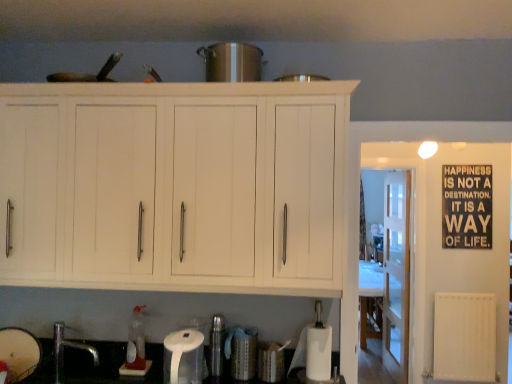
What do you see at coordinates (465, 337) in the screenshot?
I see `white plastic radiator at right` at bounding box center [465, 337].

What is the approximate width of silver metallic faucet at lower left?

silver metallic faucet at lower left is 5.24 inches wide.

The width and height of the screenshot is (512, 384). What do you see at coordinates (217, 346) in the screenshot?
I see `metallic silver canister at lower center, which is the third appliance from bottom to top` at bounding box center [217, 346].

Consider the image. What is the approximate height of metallic silver canister at lower center, which is the 1th appliance in right-to-left order?

metallic silver canister at lower center, which is the 1th appliance in right-to-left order, is 7.24 inches tall.

Image resolution: width=512 pixels, height=384 pixels. In order to click on black matte signboard at upper right in this screenshot , I will do `click(467, 206)`.

Locate an element on the screen. white plastic radiator at right is located at coordinates (465, 337).

Is shiny metallic pot at center, marked as the 3th appliance in a left-to-right arrangement, looking in the opposite direction of white plastic radiator at right?

No, shiny metallic pot at center, marked as the 3th appliance in a left-to-right arrangement, is not facing the opposite direction of white plastic radiator at right.

What's the angular difference between shiny metallic pot at center, which ranks as the 1th appliance in top-to-bottom order, and white plastic radiator at right's facing directions?

There is a 0.937-degree angle between the facing directions of shiny metallic pot at center, which ranks as the 1th appliance in top-to-bottom order, and white plastic radiator at right.

From a real-world perspective, which is physically below, shiny metallic pot at center, positioned as the fourth appliance in bottom-to-top order, or white plastic radiator at right?

white plastic radiator at right is physically lower.

Locate an element on the screen. This screenshot has height=384, width=512. radiator below the shiny metallic pot at center, positioned as the fourth appliance in bottom-to-top order (from the image's perspective) is located at coordinates (465, 337).

Can you confirm if clear glass door at center is positioned to the left of metallic silver canister at lower center, which is counted as the 2th appliance, starting from the left?

In fact, clear glass door at center is to the right of metallic silver canister at lower center, which is counted as the 2th appliance, starting from the left.

What's the angular difference between clear glass door at center and metallic silver canister at lower center, which is counted as the 2th appliance, starting from the left,'s facing directions?

The facing directions of clear glass door at center and metallic silver canister at lower center, which is counted as the 2th appliance, starting from the left, are 90.3 degrees apart.

Can you confirm if clear glass door at center is thinner than metallic silver canister at lower center, which is the third appliance from bottom to top?

Incorrect, the width of clear glass door at center is not less than that of metallic silver canister at lower center, which is the third appliance from bottom to top.

From the image's perspective, which is above, clear glass door at center or metallic silver canister at lower center, which appears as the third appliance when viewed from the right?

metallic silver canister at lower center, which appears as the third appliance when viewed from the right, from the image's perspective.

Between white matte paper towel at lower center and matte white bowl at lower left, the third appliance in the top-to-bottom sequence, which one has smaller width?

matte white bowl at lower left, the third appliance in the top-to-bottom sequence.

Could you tell me if white matte paper towel at lower center is facing matte white bowl at lower left, which is the 1th appliance from left to right?

No, white matte paper towel at lower center is not facing towards matte white bowl at lower left, which is the 1th appliance from left to right.

Find the location of a particular element. The image size is (512, 384). paper towel that appears above the matte white bowl at lower left, the second appliance from the bottom (from the image's perspective) is located at coordinates 183,357.

Is white matte paper towel at lower center completely or partially outside of matte white bowl at lower left, which is the 1th appliance from left to right?

Yes, white matte paper towel at lower center is not within matte white bowl at lower left, which is the 1th appliance from left to right.

Is matte white bowl at lower left, the fourth appliance from the right, taller than silver metallic faucet at lower left?

No, matte white bowl at lower left, the fourth appliance from the right, is not taller than silver metallic faucet at lower left.

Which of these two, matte white bowl at lower left, the fourth appliance from the right, or silver metallic faucet at lower left, is smaller?

matte white bowl at lower left, the fourth appliance from the right, is smaller.

From the image's perspective, relative to silver metallic faucet at lower left, is matte white bowl at lower left, the second appliance from the bottom, above or below?

From the image's perspective, matte white bowl at lower left, the second appliance from the bottom, appears below silver metallic faucet at lower left.

Image resolution: width=512 pixels, height=384 pixels. I want to click on appliance located on the left of silver metallic faucet at lower left, so click(x=19, y=353).

Is white plastic radiator at right to the left or to the right of metallic silver canister at lower center, which appears as the third appliance when viewed from the right, in the image?

white plastic radiator at right is positioned on metallic silver canister at lower center, which appears as the third appliance when viewed from the right,'s right side.

From a real-world perspective, who is located lower, white plastic radiator at right or metallic silver canister at lower center, positioned as the 2th appliance in top-to-bottom order?

white plastic radiator at right is physically lower.

Looking at the image, does white plastic radiator at right seem bigger or smaller compared to metallic silver canister at lower center, which is the third appliance from bottom to top?

white plastic radiator at right is bigger than metallic silver canister at lower center, which is the third appliance from bottom to top.

Based on the photo, can you confirm if translucent plastic bottle at lower left is positioned to the right of matte white bowl at lower left, the third appliance in the top-to-bottom sequence?

Yes.

Considering the relative sizes of translucent plastic bottle at lower left and matte white bowl at lower left, the third appliance in the top-to-bottom sequence, in the image provided, is translucent plastic bottle at lower left taller than matte white bowl at lower left, the third appliance in the top-to-bottom sequence,?

Yes, translucent plastic bottle at lower left is taller than matte white bowl at lower left, the third appliance in the top-to-bottom sequence.

Who is bigger, translucent plastic bottle at lower left or matte white bowl at lower left, which is the 1th appliance from left to right?

Bigger between the two is matte white bowl at lower left, which is the 1th appliance from left to right.

How different are the orientations of translucent plastic bottle at lower left and matte white bowl at lower left, the third appliance in the top-to-bottom sequence, in degrees?

0.213 degrees separate the facing orientations of translucent plastic bottle at lower left and matte white bowl at lower left, the third appliance in the top-to-bottom sequence.

From a real-world perspective, who is located higher, black matte signboard at upper right or white matte paper towel at lower center?

black matte signboard at upper right.

Does black matte signboard at upper right appear on the right side of white matte paper towel at lower center?

Indeed, black matte signboard at upper right is positioned on the right side of white matte paper towel at lower center.

Looking at their sizes, would you say black matte signboard at upper right is wider or thinner than white matte paper towel at lower center?

Clearly, black matte signboard at upper right has less width compared to white matte paper towel at lower center.

Could you tell me if black matte signboard at upper right is turned towards white matte paper towel at lower center?

No, black matte signboard at upper right does not turn towards white matte paper towel at lower center.

You are a GUI agent. You are given a task and a screenshot of the screen. Output one action in this format:
    pyautogui.click(x=<x>, y=<y>)
    Task: Click on the radiator behind the shiny metallic pot at center, marked as the 3th appliance in a left-to-right arrangement
    
    Given the screenshot: What is the action you would take?
    coord(465,337)

This screenshot has height=384, width=512. I want to click on door below the metallic silver canister at lower center, positioned as the 2th appliance in top-to-bottom order (from the image's perspective), so click(396, 274).

Which object lies further to the anchor point matte white bowl at lower left, the second appliance from the bottom, clear glass door at center or black matte signboard at upper right?

Based on the image, black matte signboard at upper right appears to be further to matte white bowl at lower left, the second appliance from the bottom.

When comparing their distances from black matte signboard at upper right, does metallic silver canister at lower center, which appears as the third appliance when viewed from the right, or metallic silver canister at lower center, which is the 1th appliance in right-to-left order, seem further?

The object further to black matte signboard at upper right is metallic silver canister at lower center, which appears as the third appliance when viewed from the right.

Which object lies nearer to the anchor point silver metallic faucet at lower left, white plastic radiator at right or shiny metallic pot at center, which ranks as the 1th appliance in top-to-bottom order?

shiny metallic pot at center, which ranks as the 1th appliance in top-to-bottom order, is closer to silver metallic faucet at lower left.

Looking at the image, which one is located further to metallic silver canister at lower center, which appears as the third appliance when viewed from the right, white wood cabinet at upper center or white plastic radiator at right?

white plastic radiator at right.

Which object lies further to the anchor point metallic silver canister at lower center, positioned as the 2th appliance in top-to-bottom order, white matte paper towel at lower center or shiny metallic pot at center, marked as the 3th appliance in a left-to-right arrangement?

The object further to metallic silver canister at lower center, positioned as the 2th appliance in top-to-bottom order, is shiny metallic pot at center, marked as the 3th appliance in a left-to-right arrangement.

Estimate the real-world distances between objects in this image. Which object is further from metallic silver canister at lower center, the 4th appliance in the top-to-bottom sequence, translucent plastic bottle at lower left or black matte signboard at upper right?

Among the two, black matte signboard at upper right is located further to metallic silver canister at lower center, the 4th appliance in the top-to-bottom sequence.

Looking at the image, which one is located closer to matte white bowl at lower left, the fourth appliance from the right, white matte paper towel at lower center or clear glass door at center?

white matte paper towel at lower center lies closer to matte white bowl at lower left, the fourth appliance from the right, than the other object.

When comparing their distances from black matte signboard at upper right, does white wood cabinet at upper center or white matte paper towel at lower center seem closer?

Among the two, white wood cabinet at upper center is located nearer to black matte signboard at upper right.

Locate an element on the screen. The width and height of the screenshot is (512, 384). faucet between white wood cabinet at upper center and metallic silver canister at lower center, positioned as the 1th appliance in bottom-to-top order, in the vertical direction is located at coordinates (63, 351).

Identify the location of faucet between white wood cabinet at upper center and matte white bowl at lower left, the third appliance in the top-to-bottom sequence, in the up-down direction. The height and width of the screenshot is (384, 512). (63, 351).

The width and height of the screenshot is (512, 384). Identify the location of radiator located between shiny metallic pot at center, marked as the 3th appliance in a left-to-right arrangement, and clear glass door at center in the depth direction. (465, 337).

The height and width of the screenshot is (384, 512). I want to click on paper towel between matte white bowl at lower left, the third appliance in the top-to-bottom sequence, and metallic silver canister at lower center, which is counted as the 2th appliance, starting from the left, from left to right, so click(x=183, y=357).